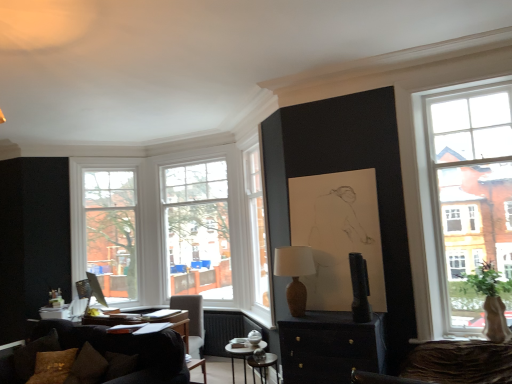
Identify the location of vacant point above matte black cabinet at center (from a real-world perspective). This screenshot has height=384, width=512. (320, 315).